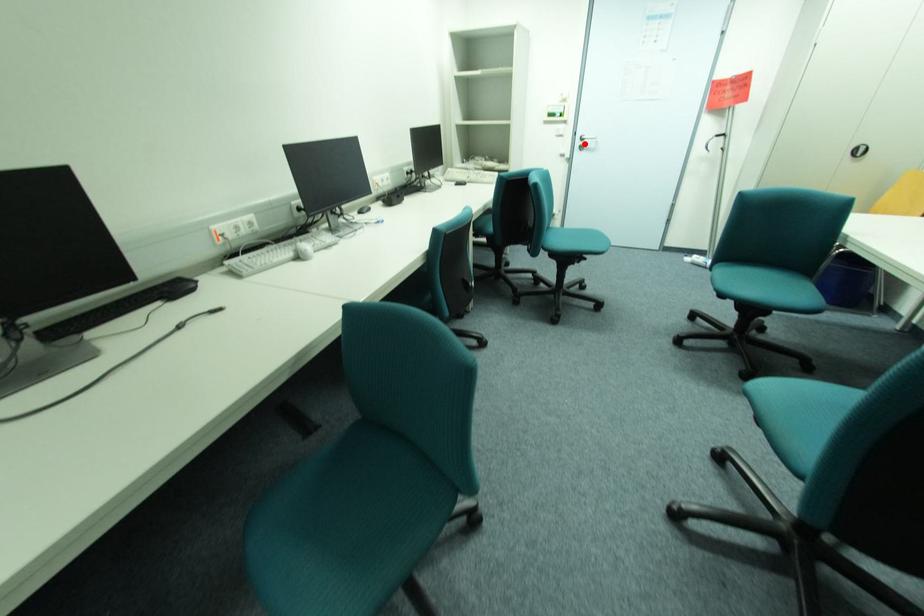
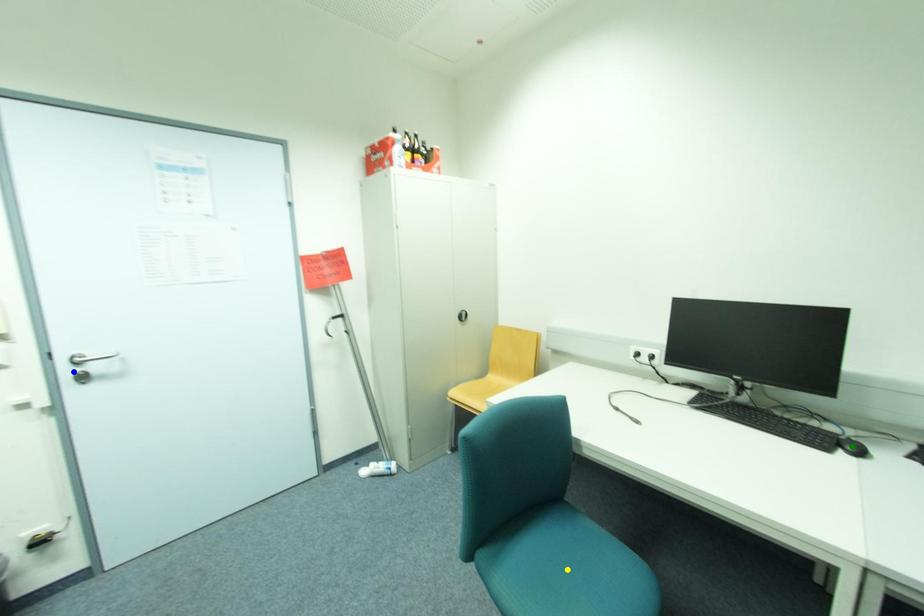
Question: I am providing you with two images of the same scene from different viewpoints. A red point is marked on the first image. You are given multiple points on the second image. In image 2, which mark is for the same physical point as the one in image 1?

Choices:
 (A) yellow point
 (B) blue point
 (C) green point

Answer: (B)